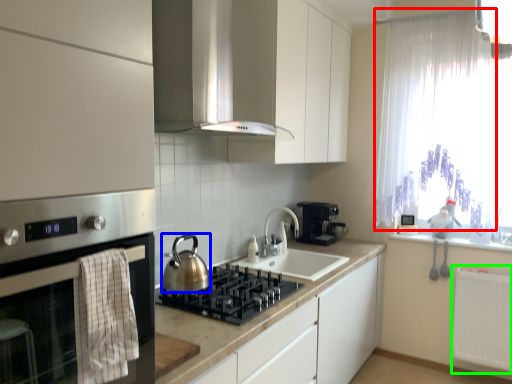
Question: Estimate the real-world distances between objects in this image. Which object is closer to curtain (highlighted by a red box), kitchen appliance (highlighted by a blue box) or radiator (highlighted by a green box)?

Choices:
 (A) kitchen appliance
 (B) radiator

Answer: (B)